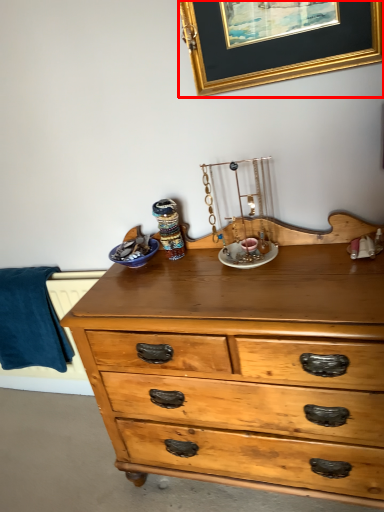
Question: From the image, what is the correct spatial relationship of picture frame (annotated by the red box) in relation to blanket?

Choices:
 (A) right
 (B) left

Answer: (A)